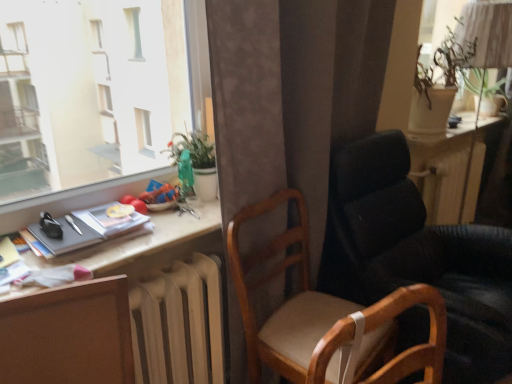
Image resolution: width=512 pixels, height=384 pixels. I want to click on free spot above wooden table at lower left, the 1th table when ordered from front to back (from a real-world perspective), so click(130, 234).